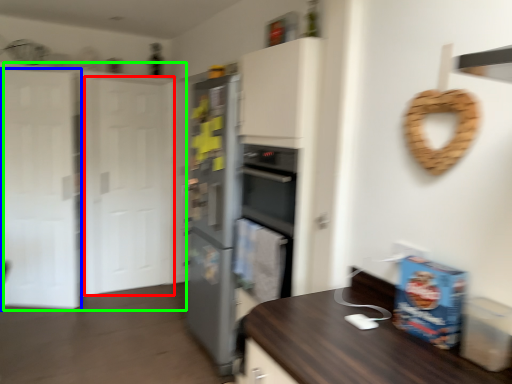
Question: Which object is the closest to the glass door (highlighted by a red box)? Choose among these: glass door (highlighted by a blue box) or door (highlighted by a green box).

Choices:
 (A) glass door
 (B) door

Answer: (B)